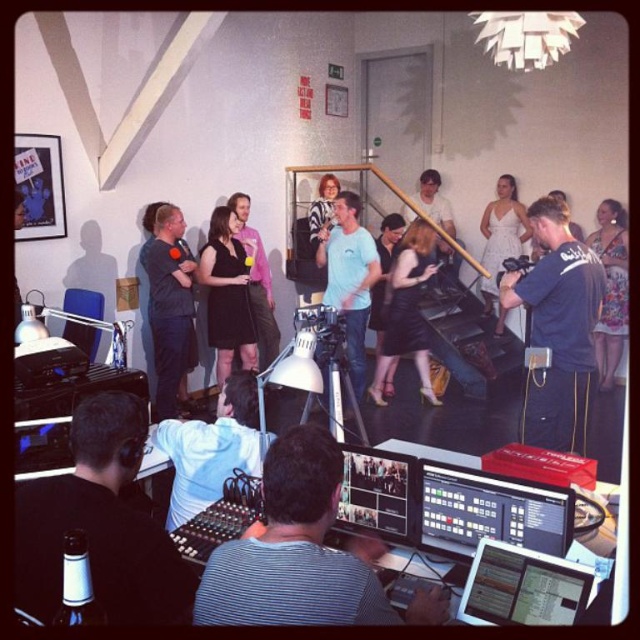
You are a photographer positioned behind the desk in the scene. You need to take a photo of both the striped shirt at center and the floral dress at center. Which clothing item will appear closer to the camera in the photo?

The striped shirt at center is shorter than the floral dress at center, so in the photo, the striped shirt at center will appear closer to the camera because it is shorter and likely positioned at the same distance from the camera as the floral dress at center.

You are a stagehand preparing to adjust the lighting for the upcoming performance. You notice the dark blue fabric camera at center and the matte black dress at center. Which object is positioned lower in the scene?

The dark blue fabric camera at center is below the matte black dress at center, so it is positioned lower in the scene.

You are a guest at the event and want to see both the dark blue shirt at center and the white satin dress at center clearly. Which one is closer to you?

The dark blue shirt at center is closer to you since it is in front of the white satin dress at center.